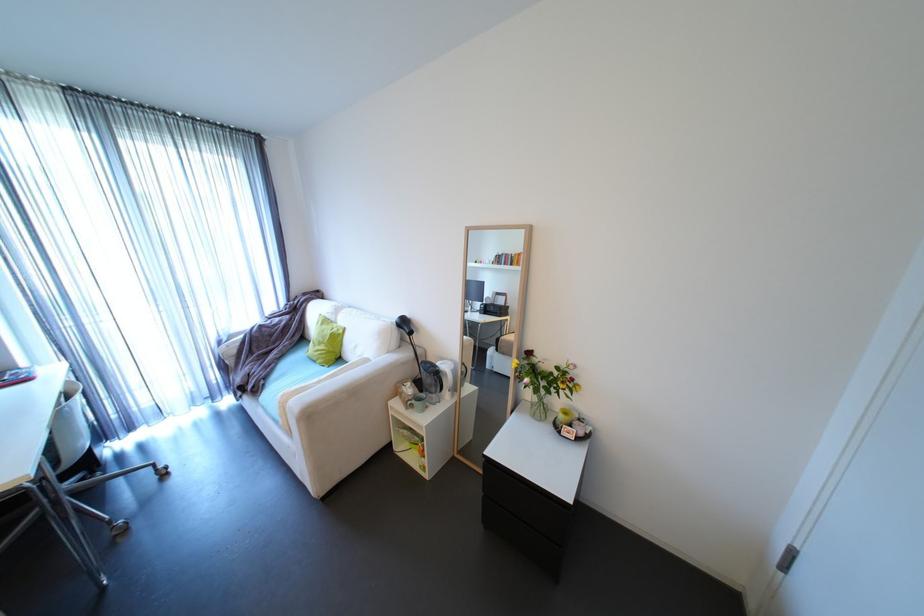
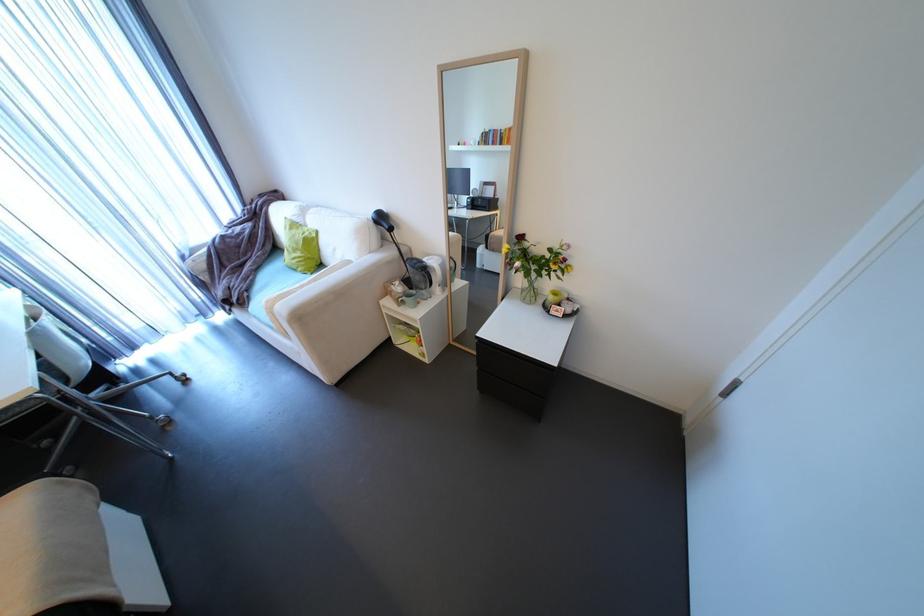
The point at (335, 367) is marked in the first image. Where is the corresponding point in the second image?

(319, 274)